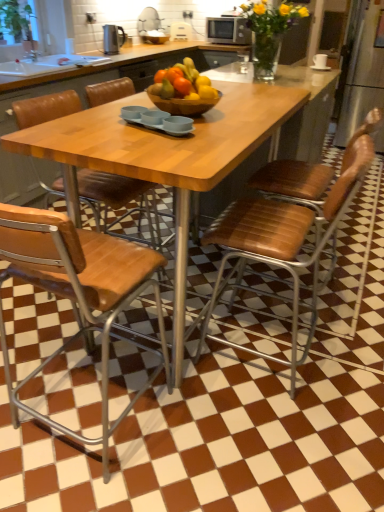
The width and height of the screenshot is (384, 512). In order to click on free space to the right of brown leather chair at center, arranged as the 2th chair when viewed from the right in this screenshot , I will do `click(354, 360)`.